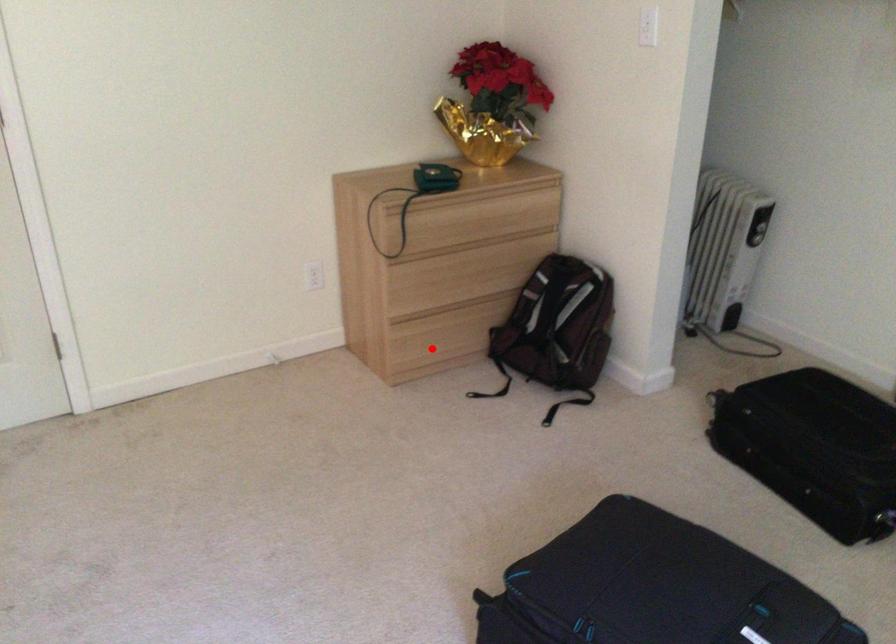
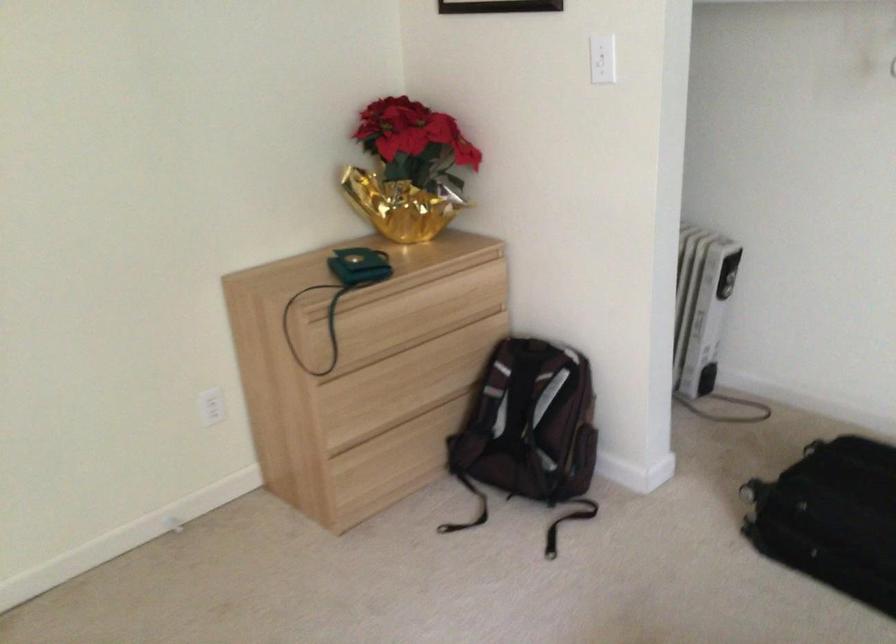
Question: I am providing you with two images of the same scene from different viewpoints. A red point is shown in image1. For the corresponding object point in image2, is it positioned nearer or farther from the camera?

Choices:
 (A) Nearer
 (B) Farther

Answer: (A)